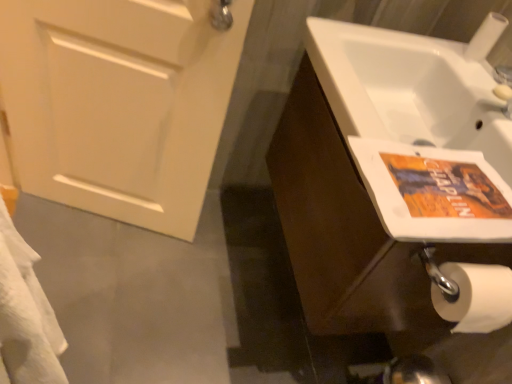
Question: Is brown wood cabinet at right outside of white matte door at left?

Choices:
 (A) no
 (B) yes

Answer: (B)

Question: Is brown wood cabinet at right facing away from white matte door at left?

Choices:
 (A) yes
 (B) no

Answer: (B)

Question: Is white matte door at left a part of brown wood cabinet at right?

Choices:
 (A) no
 (B) yes

Answer: (A)

Question: Considering the relative positions of brown wood cabinet at right and white matte door at left in the image provided, is brown wood cabinet at right to the left of white matte door at left from the viewer's perspective?

Choices:
 (A) no
 (B) yes

Answer: (A)

Question: Is brown wood cabinet at right to the right of white matte door at left from the viewer's perspective?

Choices:
 (A) no
 (B) yes

Answer: (B)

Question: Can you confirm if brown wood cabinet at right is smaller than white matte door at left?

Choices:
 (A) yes
 (B) no

Answer: (B)

Question: Is white matte toilet paper at lower right further to camera compared to brown wood cabinet at right?

Choices:
 (A) yes
 (B) no

Answer: (A)

Question: Is white matte toilet paper at lower right bigger than brown wood cabinet at right?

Choices:
 (A) no
 (B) yes

Answer: (A)

Question: From a real-world perspective, is white matte toilet paper at lower right physically below brown wood cabinet at right?

Choices:
 (A) no
 (B) yes

Answer: (A)

Question: Can you confirm if white matte toilet paper at lower right is positioned to the left of brown wood cabinet at right?

Choices:
 (A) yes
 (B) no

Answer: (B)

Question: From the image's perspective, is white matte toilet paper at lower right on top of brown wood cabinet at right?

Choices:
 (A) no
 (B) yes

Answer: (B)

Question: Is white matte toilet paper at lower right shorter than brown wood cabinet at right?

Choices:
 (A) no
 (B) yes

Answer: (B)

Question: Is brown wood cabinet at right outside of orange paper flyer at right?

Choices:
 (A) no
 (B) yes

Answer: (B)